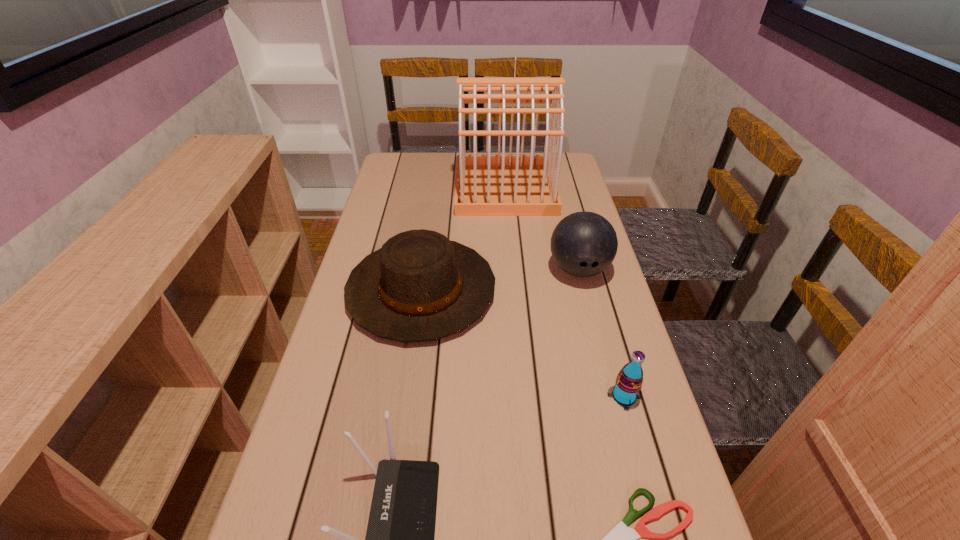
This screenshot has width=960, height=540. What are the coordinates of `birdcage` in the screenshot? It's located at (486, 185).

Locate an element on the screen. the tallest object is located at coordinates (486, 185).

Find the location of a particular element. bowling ball is located at coordinates (583, 244).

At what (x,y) coordinates should I click in order to perform the action: click on cowboy hat. Please return your answer as a coordinate pair (x, y). This screenshot has height=540, width=960. Looking at the image, I should click on (420, 286).

Find the location of a particular element. Image resolution: width=960 pixels, height=540 pixels. soda is located at coordinates (627, 389).

You are a GUI agent. You are given a task and a screenshot of the screen. Output one action in this format:
    pyautogui.click(x=<x>, y=<y>)
    Task: Click on the vacant space positioned with an open door on the farthest object
    This screenshot has height=540, width=960.
    Given the screenshot: What is the action you would take?
    pyautogui.click(x=396, y=188)

This screenshot has height=540, width=960. I want to click on vacant area situated with an open door on the farthest object, so click(x=437, y=188).

Where is `vacant space located 0.110m with an open door on the farthest object`? vacant space located 0.110m with an open door on the farthest object is located at coordinates (426, 188).

Find the location of a particular element. vacant space located 0.170m on the grip area of the bowling ball is located at coordinates (596, 339).

Locate an element on the screen. Image resolution: width=960 pixels, height=540 pixels. vacant area situated 0.230m on the right of the cowboy hat is located at coordinates (580, 290).